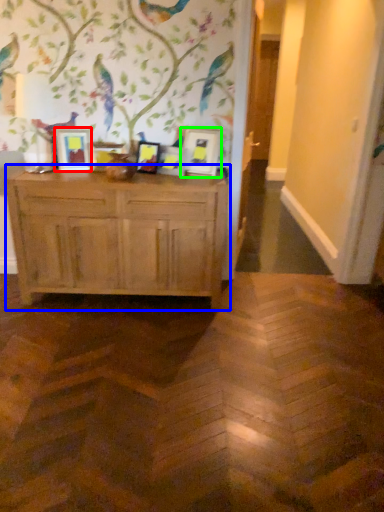
Question: Which object is positioned farthest from picture frame (highlighted by a red box)? Select from chest of drawers (highlighted by a blue box) and picture frame (highlighted by a green box).

Choices:
 (A) chest of drawers
 (B) picture frame

Answer: (B)